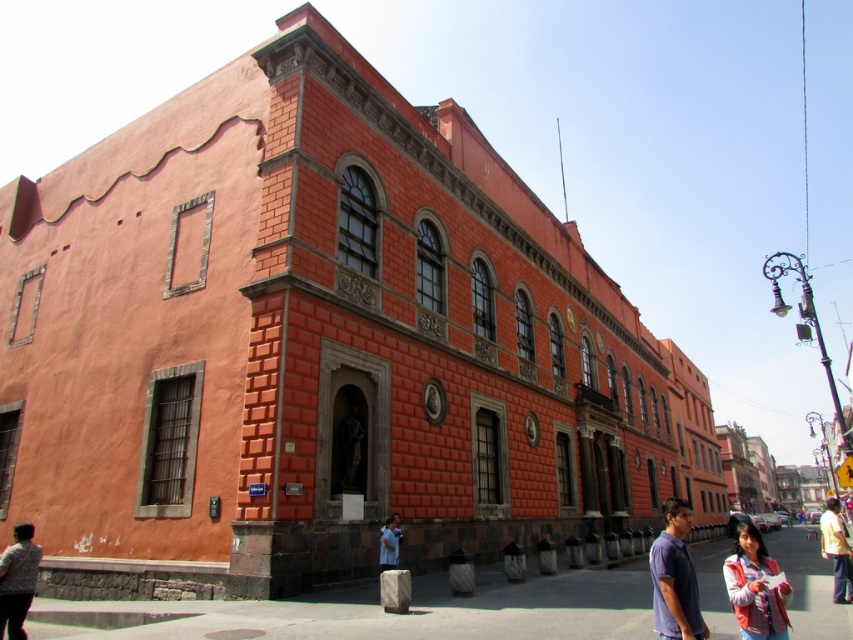
You are standing at the entrance of the historic building and want to greet both the person wearing the purple cotton shirt at lower right and the person wearing the vivid pink jacket at lower right. Which one should you approach first if you want to minimize the total distance walked?

You should approach the person wearing the purple cotton shirt at lower right first because they are closer to the entrance than the vivid pink jacket at lower right. The distance between them is 14.70 meters, so starting with the closer one reduces the backtracking needed.

Looking at this image, you are standing on the street in front of the historic building and see both the floral fabric blouse at lower left and the blue denim shirt at lower center. Which clothing item is nearer to you?

The floral fabric blouse at lower left is closer to the viewer than the blue denim shirt at lower center.